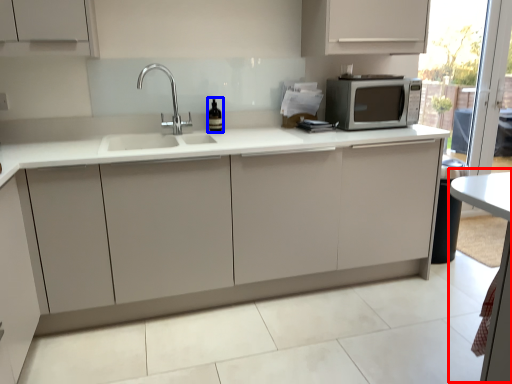
Question: Which object appears farthest to the camera in this image, table (highlighted by a red box) or wine bottle (highlighted by a blue box)?

Choices:
 (A) table
 (B) wine bottle

Answer: (B)